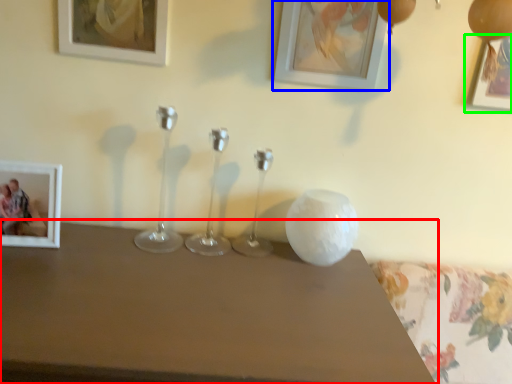
Question: Based on their relative distances, which object is farther from table (highlighted by a red box)? Choose from picture frame (highlighted by a blue box) and picture frame (highlighted by a green box).

Choices:
 (A) picture frame
 (B) picture frame

Answer: (B)